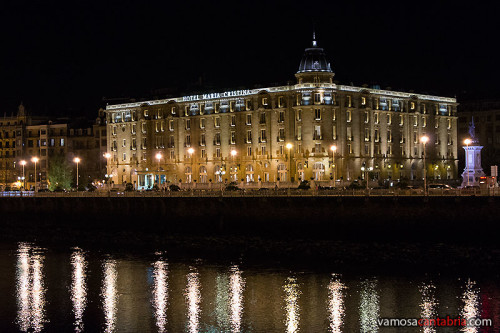
You are a GUI agent. You are given a task and a screenshot of the screen. Output one action in this format:
    pyautogui.click(x=<x>, y=<y>)
    Task: Click on the statue
    
    Given the screenshot: What is the action you would take?
    pyautogui.click(x=469, y=129)